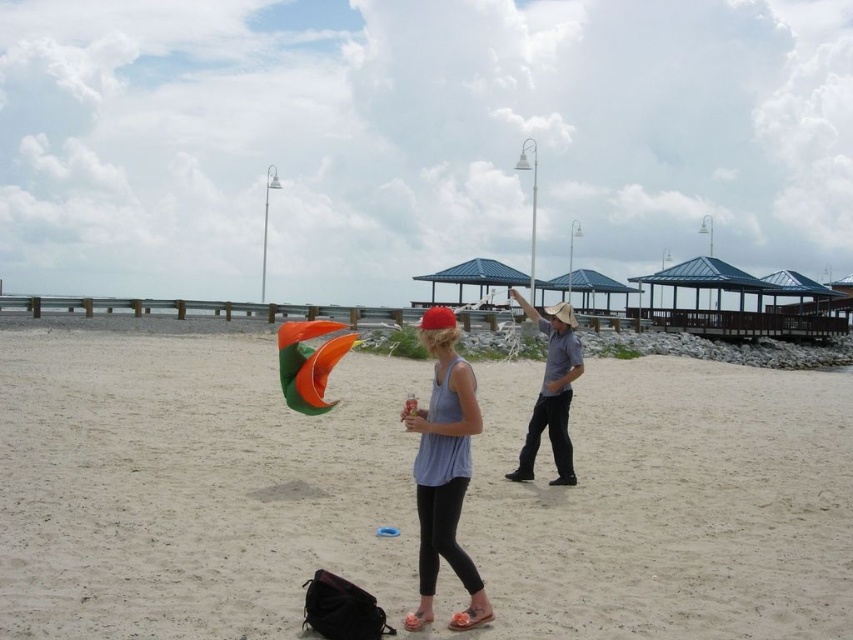
Question: Which is nearer to the matte blue tank top at center?

Choices:
 (A) orange matte kite at center
 (B) white sand at center

Answer: (A)

Question: Can you confirm if matte blue tank top at center is thinner than gray cotton shirt at center?

Choices:
 (A) yes
 (B) no

Answer: (A)

Question: Does white sand at center have a greater width compared to matte blue tank top at center?

Choices:
 (A) no
 (B) yes

Answer: (B)

Question: Which point is farther from the camera taking this photo?

Choices:
 (A) (328, 408)
 (B) (532, 433)

Answer: (A)

Question: Where is gray cotton shirt at center located in relation to orange matte kite at center in the image?

Choices:
 (A) right
 (B) left

Answer: (A)

Question: Among these objects, which one is farthest from the camera?

Choices:
 (A) white sand at center
 (B) matte blue tank top at center
 (C) gray cotton shirt at center

Answer: (C)